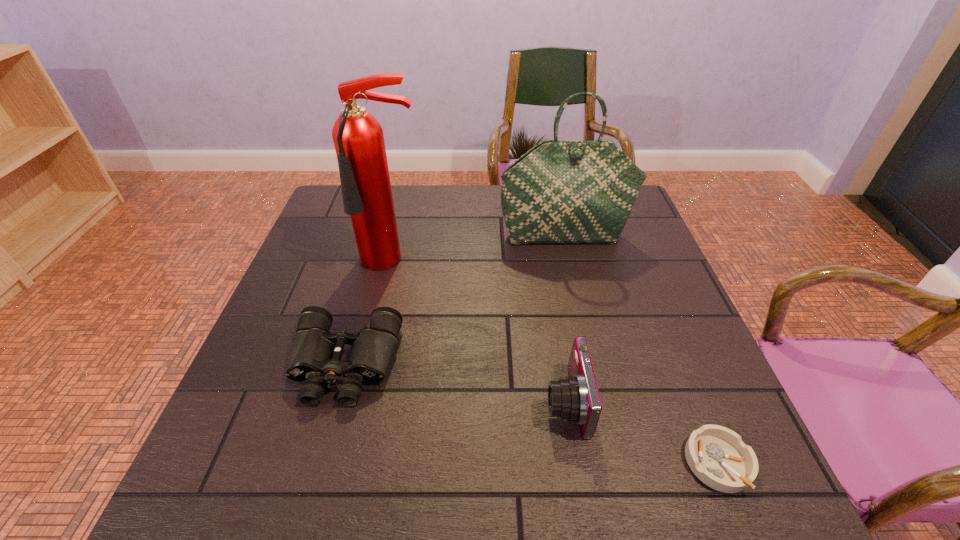
Locate an element on the screen. This screenshot has height=540, width=960. vacant space that is in between the shortest object and the second shortest object is located at coordinates (531, 414).

Locate an element on the screen. This screenshot has width=960, height=540. unoccupied position between the camera and the fourth shortest object is located at coordinates (565, 319).

Find the location of a particular element. The height and width of the screenshot is (540, 960). object that stands as the third closest to the tote bag is located at coordinates (576, 398).

At what (x,y) coordinates should I click in order to perform the action: click on object that ranks as the second closest to the fourth shortest object. Please return your answer as a coordinate pair (x, y). Looking at the image, I should click on (315, 355).

I want to click on free space that satisfies the following two spatial constraints: 1. on the front-facing side of the camera; 2. on the right side of the ashtray, so click(576, 463).

Identify the location of vacant space that satisfies the following two spatial constraints: 1. through the eyepieces of the binoculars; 2. on the left side of the shortest object. The image size is (960, 540). (318, 463).